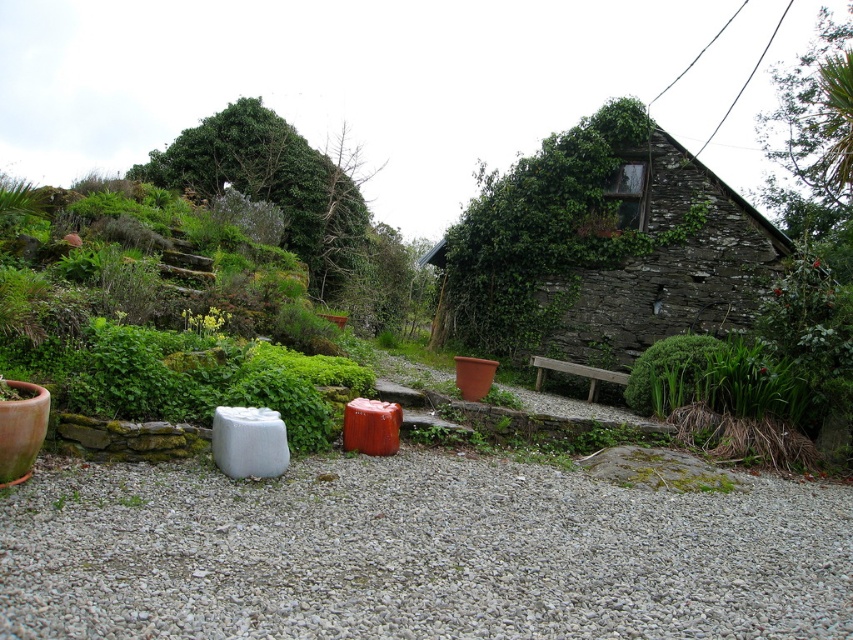
Question: Is gray gravel at center above stone textured cottage at center?

Choices:
 (A) no
 (B) yes

Answer: (A)

Question: Which point is farther to the camera?

Choices:
 (A) stone textured cottage at center
 (B) gray gravel at center

Answer: (A)

Question: Is the position of gray gravel at center less distant than that of stone textured cottage at center?

Choices:
 (A) no
 (B) yes

Answer: (B)

Question: Which point is closer to the camera?

Choices:
 (A) stone textured cottage at center
 (B) gray gravel at center

Answer: (B)

Question: Is gray gravel at center to the left of stone textured cottage at center from the viewer's perspective?

Choices:
 (A) yes
 (B) no

Answer: (A)

Question: Among these points, which one is nearest to the camera?

Choices:
 (A) (450, 458)
 (B) (471, 326)

Answer: (A)